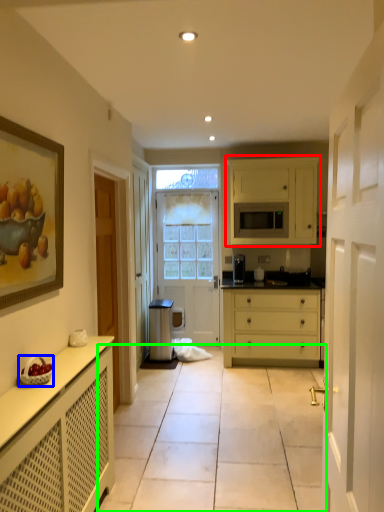
Question: Based on their relative distances, which object is nearer to cabinetry (highlighted by a red box)? Choose from fruit dish (highlighted by a blue box) and path (highlighted by a green box).

Choices:
 (A) fruit dish
 (B) path

Answer: (B)